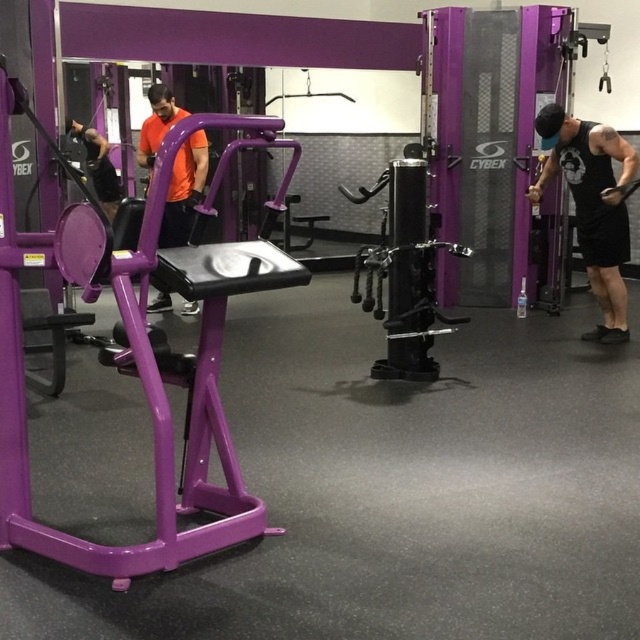
You are a gym trainer who needs to hand a water bottle to both individuals wearing the black matte tank top at right and the orange fabric shirt at center. If you start at the entrance of the gym, which is located behind the purple Cybex machine with a black seat and armrests, which individual should you approach first to minimize the total distance walked?

You should first approach the orange fabric shirt at center because they are closer to the entrance than the black matte tank top at right. The entrance is behind the purple Cybex machine with a black seat and armrests, so the orange fabric shirt at center is only 9.80 feet away from the black matte tank top at right, but their exact positions relative to the entrance aren

You are a gym trainer observing the black matte tank top at right and the orange fabric shirt at center. Which piece of clothing appears bigger in size?

The black matte tank top at right has a larger size compared to the orange fabric shirt at center.

You are standing in the gym and want to reach the point marked at coordinates (540, 193). Considering the gym layout described, can you estimate how far you need to walk to get there?

The point at coordinates (540, 193) is 5.05 meters away from the camera, so you need to walk approximately 5.05 meters to reach it.